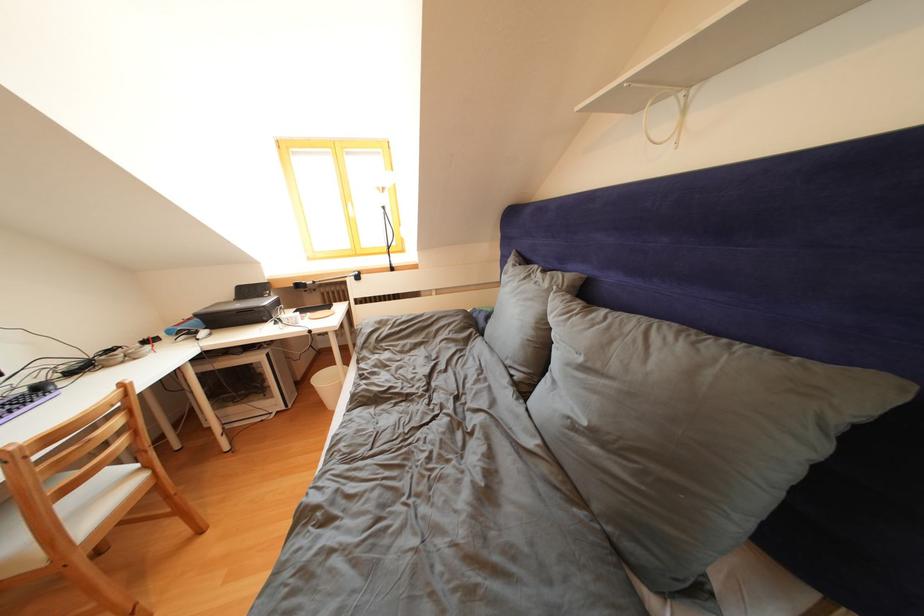
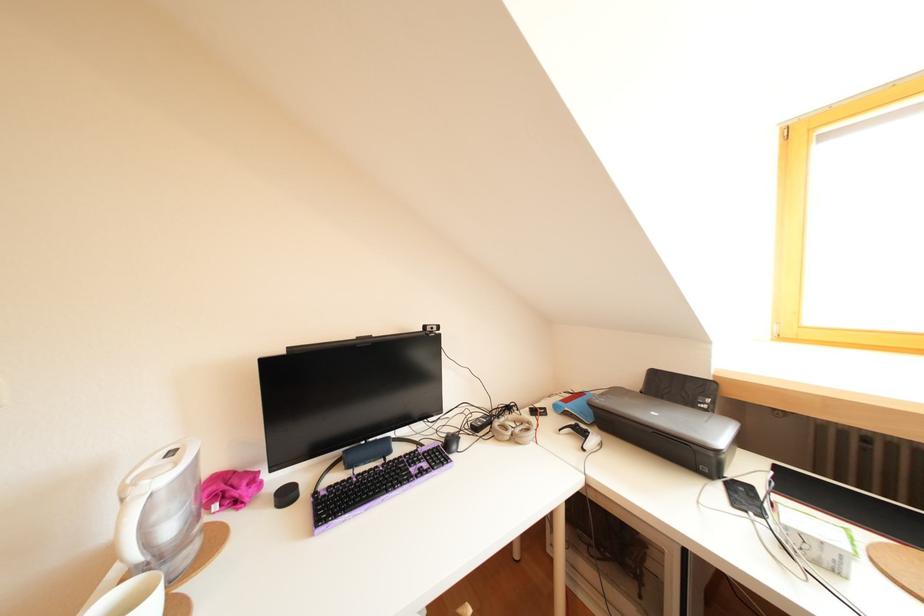
Where in the second image is the point corresponding to point (118, 357) from the first image?

(516, 413)